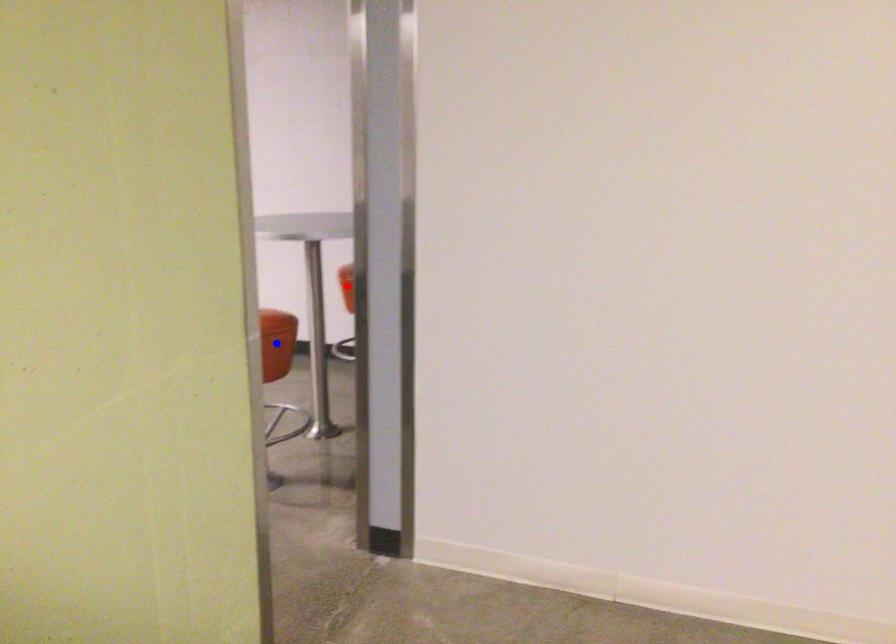
Question: Which of the two points in the image is closer to the camera?

Choices:
 (A) Blue point is closer.
 (B) Red point is closer.

Answer: (B)